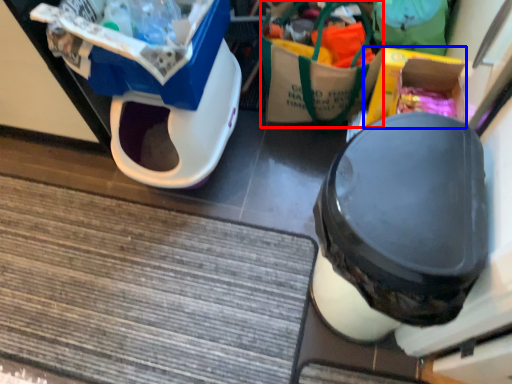
Question: Which of the following is the farthest to the observer, garbage (highlighted by a red box) or storage box (highlighted by a blue box)?

Choices:
 (A) garbage
 (B) storage box

Answer: (A)